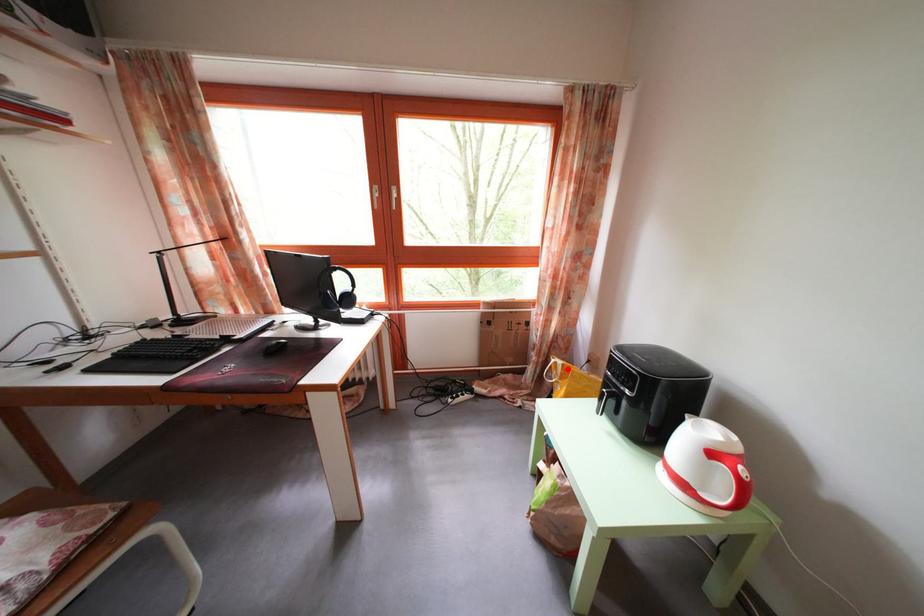
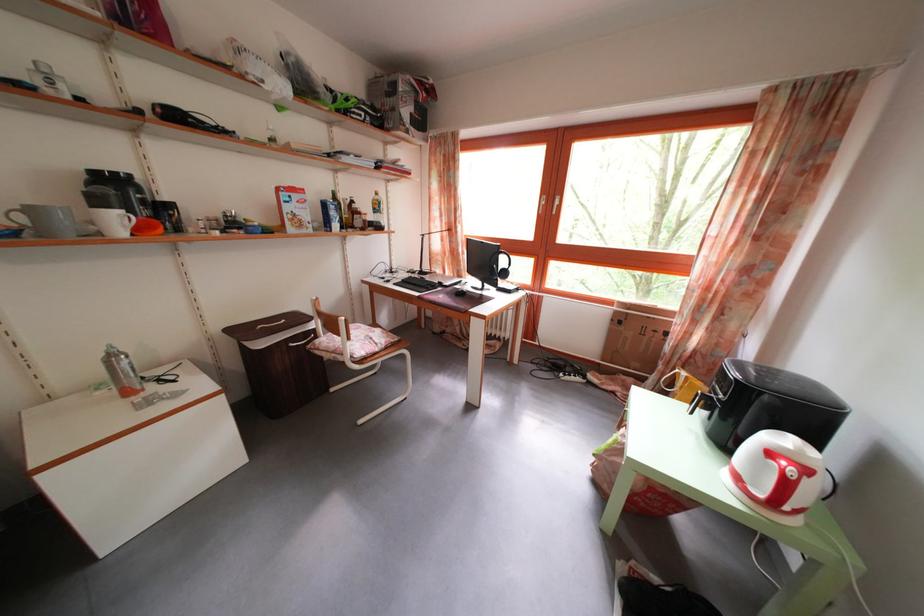
The point at the highlighted location is marked in the first image. Where is the corresponding point in the second image?

(691, 381)